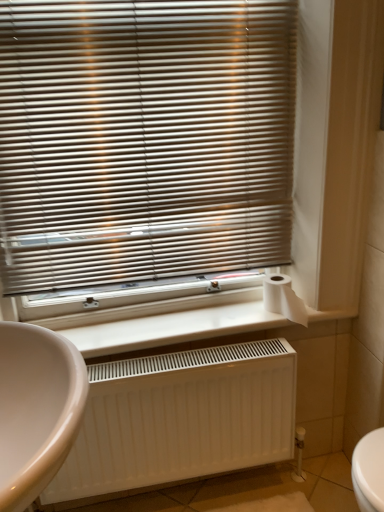
Where is `vacant space situated above white matte radiator at lower center (from a real-world perspective)`? The width and height of the screenshot is (384, 512). vacant space situated above white matte radiator at lower center (from a real-world perspective) is located at coordinates (186, 326).